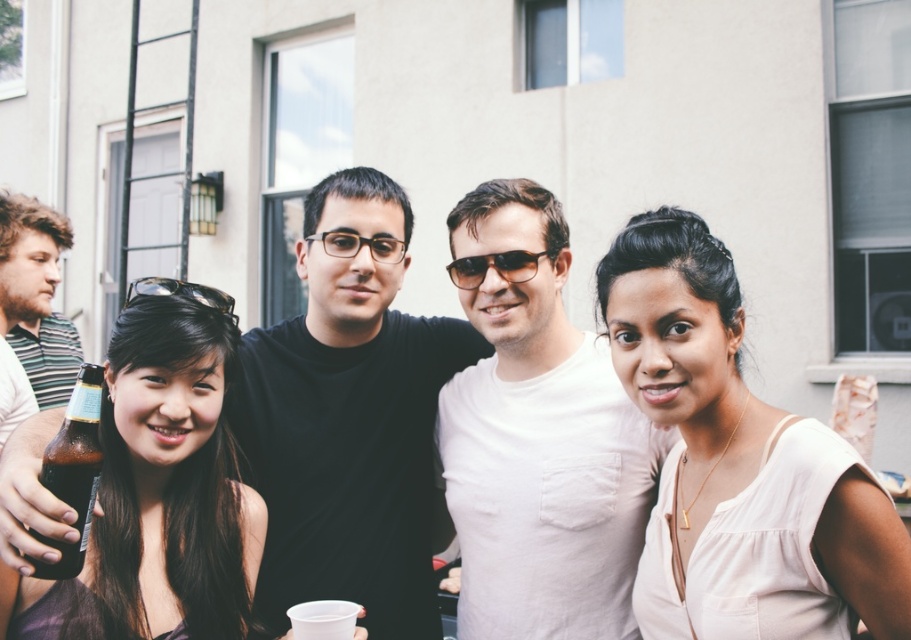
Who is more distant from viewer, (543, 620) or (660, 529)?

Positioned behind is point (543, 620).

Can you confirm if white matte shirt at center is smaller than pale pink fabric at center?

Actually, white matte shirt at center might be larger than pale pink fabric at center.

Does point (630, 515) lie in front of point (681, 237)?

No, it is behind (681, 237).

You are a GUI agent. You are given a task and a screenshot of the screen. Output one action in this format:
    pyautogui.click(x=<x>, y=<y>)
    Task: Click on the white matte shirt at center
    The height and width of the screenshot is (640, 911).
    Given the screenshot: What is the action you would take?
    pyautogui.click(x=539, y=444)

Between black matte shirt at center and black plastic sunglasses at center, which one appears on the left side from the viewer's perspective?

black matte shirt at center

Does point (385, 592) come behind point (535, 259)?

Yes, point (385, 592) is farther from viewer.

Does point (397, 355) come closer to viewer compared to point (464, 273)?

No, (397, 355) is further to viewer.

Find the location of a particular element. Image resolution: width=911 pixels, height=640 pixels. black matte shirt at center is located at coordinates (347, 419).

The image size is (911, 640). Identify the location of brown matte bottle at left. (165, 486).

Is brown matte bottle at left above brown glass bottle at lower left?

No, brown matte bottle at left is not above brown glass bottle at lower left.

Find the location of a particular element. brown matte bottle at left is located at coordinates (165, 486).